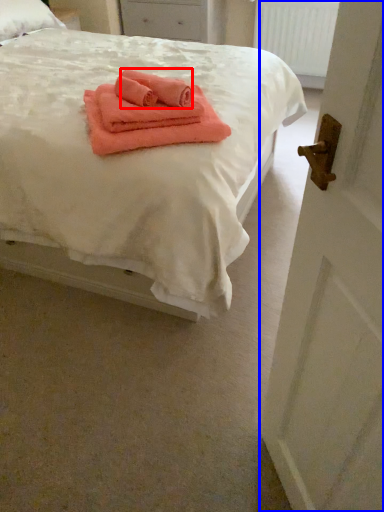
Question: Among these objects, which one is farthest to the camera, cloth (highlighted by a red box) or door (highlighted by a blue box)?

Choices:
 (A) cloth
 (B) door

Answer: (A)